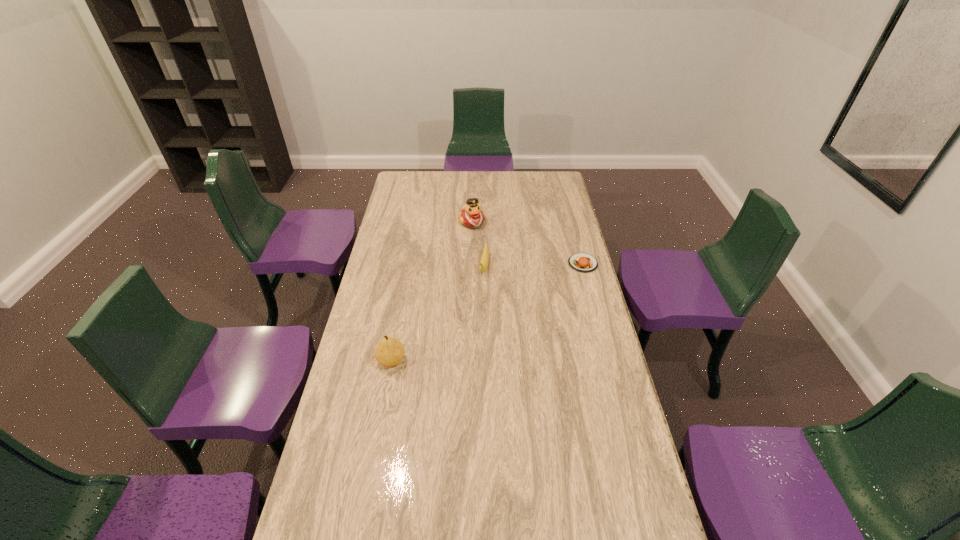
The height and width of the screenshot is (540, 960). I want to click on vacant space located 0.200m at the stem of the banana, so click(x=477, y=318).

At what (x,y) coordinates should I click in order to perform the action: click on vacant space situated on the face of the farthest object. Please return your answer as a coordinate pair (x, y). The image size is (960, 540). Looking at the image, I should click on (505, 274).

Find the location of a particular element. free spot located 0.380m on the face of the farthest object is located at coordinates (510, 282).

Image resolution: width=960 pixels, height=540 pixels. In order to click on vacant area situated 0.400m on the face of the farthest object in this screenshot , I will do `click(512, 285)`.

At what (x,y) coordinates should I click in order to perform the action: click on object positioned at the left edge. Please return your answer as a coordinate pair (x, y). Looking at the image, I should click on (389, 352).

Where is `object that is at the right edge`? This screenshot has height=540, width=960. object that is at the right edge is located at coordinates (581, 262).

Locate an element on the screen. The height and width of the screenshot is (540, 960). blank space at the far edge is located at coordinates (455, 174).

In the image, there is a desktop. Where is `blank space at the left edge`? The width and height of the screenshot is (960, 540). blank space at the left edge is located at coordinates (405, 291).

You are a GUI agent. You are given a task and a screenshot of the screen. Output one action in this format:
    pyautogui.click(x=<x>, y=<y>)
    Task: Click on the vacant position at the right edge of the desktop
    The image size is (960, 540).
    Given the screenshot: What is the action you would take?
    pyautogui.click(x=612, y=366)

Identify the location of free space at the far left corner of the desktop. The width and height of the screenshot is (960, 540). (403, 188).